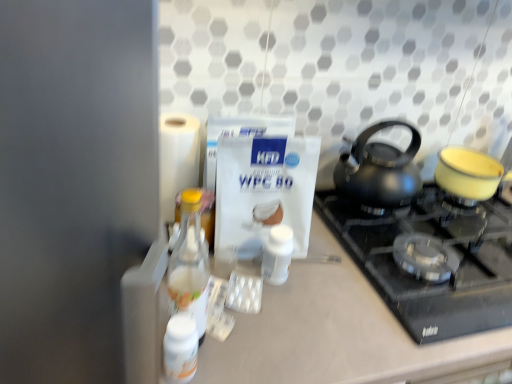
What are the coordinates of `vacant space in between clear glass bottle at left, the first bottle from the front, and white matte bottle at center, the 3th bottle viewed from the front` in the screenshot? It's located at (239, 304).